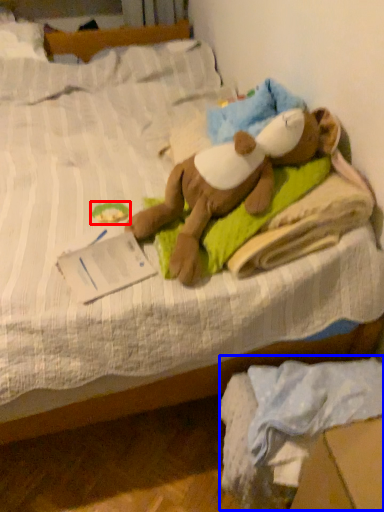
Question: Which of the following is the closest to the observer, toy (highlighted by a red box) or material (highlighted by a blue box)?

Choices:
 (A) toy
 (B) material

Answer: (B)